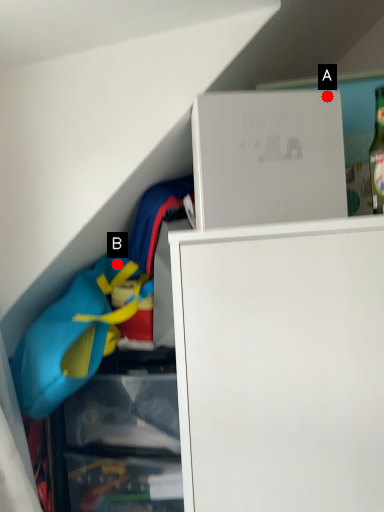
Question: Two points are circled on the image, labeled by A and B beside each circle. Which point is closer to the camera taking this photo?

Choices:
 (A) A is closer
 (B) B is closer

Answer: (A)